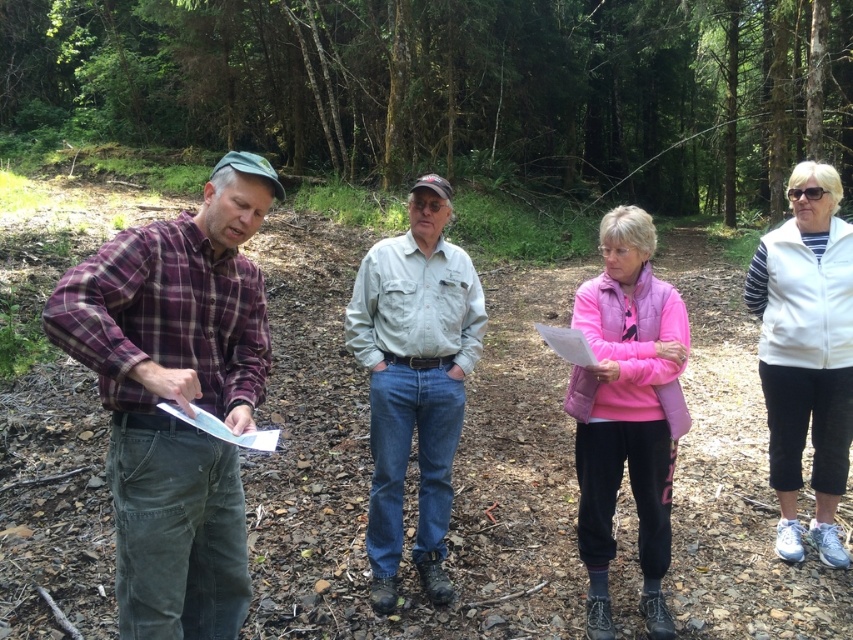
You are a photographer positioned in the forest scene. You need to capture a photo where both the white fleece vest at right and the pink matte clipboard at center are clearly visible. Based on their positions, which object should you ensure is in the foreground to avoid it being obscured by the other?

The white fleece vest at right is below the pink matte clipboard at center, so to ensure both are visible, the pink matte clipboard at center should be in the foreground. This way, the white fleece vest at right, being lower, won not obstruct it.